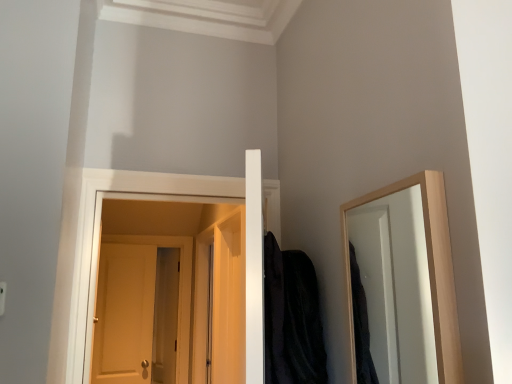
Where is `black velvet robe at center`? black velvet robe at center is located at coordinates (292, 318).

This screenshot has width=512, height=384. What do you see at coordinates (292, 318) in the screenshot?
I see `black velvet robe at center` at bounding box center [292, 318].

What do you see at coordinates (179, 289) in the screenshot? I see `matte wooden door at center` at bounding box center [179, 289].

In order to click on matte wooden door at center in this screenshot , I will do pyautogui.click(x=179, y=289).

Identify the location of black velvet robe at center. The width and height of the screenshot is (512, 384). (292, 318).

Considering the relative positions of matte wooden door at center and black velvet robe at center in the image provided, is matte wooden door at center to the right of black velvet robe at center from the viewer's perspective?

Incorrect, matte wooden door at center is not on the right side of black velvet robe at center.

Is the depth of matte wooden door at center greater than that of black velvet robe at center?

That is True.

Considering the points (188, 308) and (290, 323), which point is behind, point (188, 308) or point (290, 323)?

Point (188, 308)

From the image's perspective, is matte wooden door at center above or below black velvet robe at center?

Clearly, from the image's perspective, matte wooden door at center is below black velvet robe at center.

From a real-world perspective, is matte wooden door at center positioned above or below black velvet robe at center?

matte wooden door at center is below black velvet robe at center.

Which object is wider, matte wooden door at center or black velvet robe at center?

black velvet robe at center.

Considering the sizes of matte wooden door at center and black velvet robe at center in the image, is matte wooden door at center taller or shorter than black velvet robe at center?

Considering their sizes, matte wooden door at center has more height than black velvet robe at center.

Between matte wooden door at center and black velvet robe at center, which one has larger size?

With larger size is matte wooden door at center.

Do you think matte wooden door at center is within black velvet robe at center, or outside of it?

matte wooden door at center is located beyond the bounds of black velvet robe at center.

Consider the image. Is matte wooden door at center far from black velvet robe at center?

Indeed, matte wooden door at center is not near black velvet robe at center.

Is matte wooden door at center oriented towards black velvet robe at center?

Yes.

Looking at this image, how many degrees apart are the facing directions of matte wooden door at center and black velvet robe at center?

The angular difference between matte wooden door at center and black velvet robe at center is 65.2 degrees.

Locate an element on the screen. robe located on the right of matte wooden door at center is located at coordinates (292, 318).

Can you confirm if black velvet robe at center is positioned to the right of matte wooden door at center?

Yes.

Who is more distant, black velvet robe at center or matte wooden door at center?

matte wooden door at center is more distant.

Considering the positions of point (292, 336) and point (184, 305), is point (292, 336) closer or farther from the camera than point (184, 305)?

Point (292, 336) is closer to the camera than point (184, 305).

From the image's perspective, who appears lower, black velvet robe at center or matte wooden door at center?

matte wooden door at center.

From a real-world perspective, who is located higher, black velvet robe at center or matte wooden door at center?

In real-world perspective, black velvet robe at center is above.

Is black velvet robe at center wider than matte wooden door at center?

Correct, the width of black velvet robe at center exceeds that of matte wooden door at center.

Does black velvet robe at center have a greater height compared to matte wooden door at center?

Incorrect, the height of black velvet robe at center is not larger of that of matte wooden door at center.

Considering the sizes of objects black velvet robe at center and matte wooden door at center in the image provided, who is smaller, black velvet robe at center or matte wooden door at center?

black velvet robe at center is smaller.

Can matte wooden door at center be found inside black velvet robe at center?

No, matte wooden door at center is located outside of black velvet robe at center.

Is black velvet robe at center touching matte wooden door at center?

No, black velvet robe at center is not with matte wooden door at center.

Is black velvet robe at center facing away from matte wooden door at center?

No.

What's the angular difference between black velvet robe at center and matte wooden door at center's facing directions?

They differ by 65.2 degrees in their facing directions.

I want to click on door below the black velvet robe at center (from the image's perspective), so click(x=179, y=289).

Where is `door that is below the black velvet robe at center (from the image's perspective)`? The image size is (512, 384). door that is below the black velvet robe at center (from the image's perspective) is located at coordinates (179, 289).

Identify the location of door that is behind the black velvet robe at center. This screenshot has height=384, width=512. (179, 289).